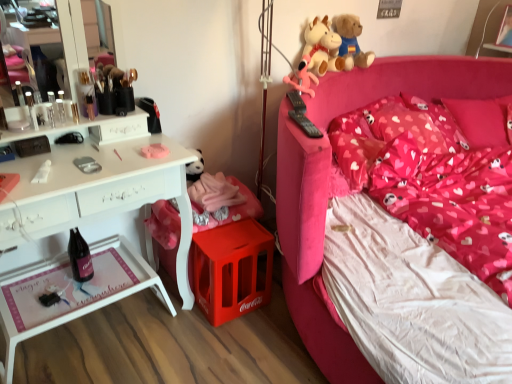
You are a GUI agent. You are given a task and a screenshot of the screen. Output one action in this format:
    pyautogui.click(x=<x>, y=<y>)
    Task: Click on the soft plush toys at upper right, placed as the 3th toy when sorted from front to back
    The width and height of the screenshot is (512, 384).
    Given the screenshot: What is the action you would take?
    pyautogui.click(x=351, y=42)

At what (x,y) coordinates should I click in order to perform the action: click on black glass bottle at lower left. Please return your answer as a coordinate pair (x, y). The image size is (512, 384). Looking at the image, I should click on (80, 257).

Find the location of `heart-patterned fabric pillow at upper right, which appears as the first pillow when viewed from the right`. heart-patterned fabric pillow at upper right, which appears as the first pillow when viewed from the right is located at coordinates (481, 120).

What are the coordinates of `white plastic tray at left` in the screenshot? It's located at (97, 192).

Describe the element at coordinates (310, 251) in the screenshot. I see `pink fabric bed at right` at that location.

What do you see at coordinates (439, 121) in the screenshot? The height and width of the screenshot is (384, 512). I see `heart-patterned fabric pillow at upper right, which is the second pillow from right to left` at bounding box center [439, 121].

The image size is (512, 384). Identify the location of soft plush cow at upper right, which ranks as the 2th toy in front-to-back order. (322, 47).

From a real-world perspective, is pink fabric bed at right above or below matte pink mattress at center?

pink fabric bed at right is below matte pink mattress at center.

From the image's perspective, between pink fabric bed at right and matte pink mattress at center, who is located below?

pink fabric bed at right, from the image's perspective.

Does pink fabric bed at right touch matte pink mattress at center?

They are not placed beside each other.

Would you say matte pink mattress at center is part of pink fabric bed at right's contents?

No, matte pink mattress at center is not inside pink fabric bed at right.

Locate an element on the screen. the 1st pillow directly above the white plastic tray at left (from a real-world perspective) is located at coordinates (481, 120).

Which of these two, heart-patterned fabric pillow at upper right, the third pillow when ordered from left to right, or white plastic tray at left, is bigger?

white plastic tray at left.

Is heart-patterned fabric pillow at upper right, which appears as the first pillow when viewed from the right, not within white plastic tray at left?

Indeed, heart-patterned fabric pillow at upper right, which appears as the first pillow when viewed from the right, is completely outside white plastic tray at left.

How distant is heart-patterned fabric pillow at upper right, the third pillow when ordered from left to right, from white plastic tray at left?

6.17 feet.

Is soft plush toys at upper right, placed as the 3th toy when sorted from front to back, far away from pink fabric pillow at upper right, the third pillow when ordered from right to left?

soft plush toys at upper right, placed as the 3th toy when sorted from front to back, is near pink fabric pillow at upper right, the third pillow when ordered from right to left, not far away.

Is pink fabric pillow at upper right, the third pillow when ordered from right to left, inside soft plush toys at upper right, placed as the 3th toy when sorted from front to back?

No, pink fabric pillow at upper right, the third pillow when ordered from right to left, is not a part of soft plush toys at upper right, placed as the 3th toy when sorted from front to back.

Is soft plush toys at upper right, placed as the 3th toy when sorted from front to back, turned away from pink fabric pillow at upper right, the third pillow when ordered from right to left?

No, soft plush toys at upper right, placed as the 3th toy when sorted from front to back,'s orientation is not away from pink fabric pillow at upper right, the third pillow when ordered from right to left.

From a real-world perspective, which object rests below the other?

pink fabric pillow at upper right, the third pillow when ordered from right to left, is physically lower.

Measure the distance between matte pink mattress at center and matte pink plush at upper right, which is counted as the 3th toy, starting from the back.

74.98 centimeters.

Is matte pink mattress at center at the left side of matte pink plush at upper right, which is counted as the 3th toy, starting from the back?

In fact, matte pink mattress at center is to the right of matte pink plush at upper right, which is counted as the 3th toy, starting from the back.

Considering the relative sizes of matte pink mattress at center and matte pink plush at upper right, which appears as the first toy when viewed from the front, in the image provided, is matte pink mattress at center bigger than matte pink plush at upper right, which appears as the first toy when viewed from the front,?

Yes.

From the image's perspective, does matte pink mattress at center appear higher than matte pink plush at upper right, which appears as the first toy when viewed from the front?

No, from the image's perspective, matte pink mattress at center is not above matte pink plush at upper right, which appears as the first toy when viewed from the front.

Is heart-patterned fabric pillow at upper right, acting as the 2th pillow starting from the left, at the right side of soft plush toys at upper right, placed as the 3th toy when sorted from front to back?

Correct, you'll find heart-patterned fabric pillow at upper right, acting as the 2th pillow starting from the left, to the right of soft plush toys at upper right, placed as the 3th toy when sorted from front to back.

Which point is more distant from viewer, (442,108) or (362,59)?

The point (442,108) is farther.

Considering the sizes of objects heart-patterned fabric pillow at upper right, acting as the 2th pillow starting from the left, and soft plush toys at upper right, placed as the 3th toy when sorted from front to back, in the image provided, who is shorter, heart-patterned fabric pillow at upper right, acting as the 2th pillow starting from the left, or soft plush toys at upper right, placed as the 3th toy when sorted from front to back,?

Standing shorter between the two is heart-patterned fabric pillow at upper right, acting as the 2th pillow starting from the left.

Which object is thinner, heart-patterned fabric pillow at upper right, acting as the 2th pillow starting from the left, or soft plush toys at upper right, the 1th toy when ordered from back to front?

soft plush toys at upper right, the 1th toy when ordered from back to front.

Is matte pink mattress at center bigger than heart-patterned fabric pillow at upper right, the third pillow when ordered from left to right?

Indeed, matte pink mattress at center has a larger size compared to heart-patterned fabric pillow at upper right, the third pillow when ordered from left to right.

Is the surface of matte pink mattress at center in direct contact with heart-patterned fabric pillow at upper right, which appears as the first pillow when viewed from the right?

No, matte pink mattress at center is not with heart-patterned fabric pillow at upper right, which appears as the first pillow when viewed from the right.

Where is `mattress in front of the heart-patterned fabric pillow at upper right, which appears as the first pillow when viewed from the right`? mattress in front of the heart-patterned fabric pillow at upper right, which appears as the first pillow when viewed from the right is located at coordinates (453, 204).

Does matte pink mattress at center have a lesser height compared to heart-patterned fabric pillow at upper right, the third pillow when ordered from left to right?

No.

Are soft plush toys at upper right, the 1th toy when ordered from back to front, and white plastic tray at left making contact?

soft plush toys at upper right, the 1th toy when ordered from back to front, is not next to white plastic tray at left, and they're not touching.

What's the angular difference between soft plush toys at upper right, placed as the 3th toy when sorted from front to back, and white plastic tray at left's facing directions?

There is a 1.88-degree angle between the facing directions of soft plush toys at upper right, placed as the 3th toy when sorted from front to back, and white plastic tray at left.

Is soft plush toys at upper right, the 1th toy when ordered from back to front, smaller than white plastic tray at left?

Correct, soft plush toys at upper right, the 1th toy when ordered from back to front, occupies less space than white plastic tray at left.

Could you tell me if soft plush toys at upper right, placed as the 3th toy when sorted from front to back, is facing white plastic tray at left?

No, soft plush toys at upper right, placed as the 3th toy when sorted from front to back, is not turned towards white plastic tray at left.

The width and height of the screenshot is (512, 384). In order to click on mattress that is behind the pink fabric bed at right in this screenshot , I will do `click(453, 204)`.

This screenshot has height=384, width=512. What are the coordinates of `desk lying in front of the heart-patterned fabric pillow at upper right, the third pillow when ordered from left to right` in the screenshot? It's located at (97, 192).

Looking at the image, which one is located further to soft plush toys at upper right, placed as the 3th toy when sorted from front to back, pink fabric bed at right or heart-patterned fabric pillow at upper right, which is the second pillow from right to left?

The object further to soft plush toys at upper right, placed as the 3th toy when sorted from front to back, is heart-patterned fabric pillow at upper right, which is the second pillow from right to left.

When comparing their distances from soft plush cow at upper right, which is the 2th toy from back to front, does matte pink plush at upper right, which is counted as the 3th toy, starting from the back, or heart-patterned fabric pillow at upper right, acting as the 2th pillow starting from the left, seem closer?

Based on the image, matte pink plush at upper right, which is counted as the 3th toy, starting from the back, appears to be nearer to soft plush cow at upper right, which is the 2th toy from back to front.

When comparing their distances from white plastic tray at left, does black glass bottle at lower left or matte pink mattress at center seem closer?

The object closer to white plastic tray at left is black glass bottle at lower left.

When comparing their distances from white plastic tray at left, does heart-patterned fabric pillow at upper right, the third pillow when ordered from left to right, or pink fabric bed at right seem closer?

Based on the image, pink fabric bed at right appears to be nearer to white plastic tray at left.

Based on their spatial positions, is pink fabric bed at right or pink fabric pillow at upper right, the 1th pillow when ordered from left to right, further from matte pink plush at upper right, which appears as the first toy when viewed from the front?

pink fabric pillow at upper right, the 1th pillow when ordered from left to right.

Based on their spatial positions, is heart-patterned fabric pillow at upper right, which appears as the first pillow when viewed from the right, or matte pink mattress at center further from black glass bottle at lower left?

heart-patterned fabric pillow at upper right, which appears as the first pillow when viewed from the right, is positioned further to the anchor black glass bottle at lower left.

Looking at the image, which one is located further to heart-patterned fabric pillow at upper right, which appears as the first pillow when viewed from the right, pink fabric bed at right or matte pink mattress at center?

matte pink mattress at center is further to heart-patterned fabric pillow at upper right, which appears as the first pillow when viewed from the right.

When comparing their distances from pink fabric bed at right, does pink fabric pillow at upper right, the third pillow when ordered from right to left, or soft plush cow at upper right, which is the 2th toy from back to front, seem further?

The object further to pink fabric bed at right is pink fabric pillow at upper right, the third pillow when ordered from right to left.

At what (x,y) coordinates should I click in order to perform the action: click on mattress between black glass bottle at lower left and heart-patterned fabric pillow at upper right, which appears as the first pillow when viewed from the right, in the horizontal direction. Please return your answer as a coordinate pair (x, y). Image resolution: width=512 pixels, height=384 pixels. Looking at the image, I should click on (453, 204).

I want to click on mattress positioned between pink fabric bed at right and heart-patterned fabric pillow at upper right, which is the second pillow from right to left, from near to far, so click(x=453, y=204).

Locate an element on the screen. The height and width of the screenshot is (384, 512). toy located between soft plush cow at upper right, which ranks as the 2th toy in front-to-back order, and pink fabric pillow at upper right, the 1th pillow when ordered from left to right, in the left-right direction is located at coordinates (351, 42).

Image resolution: width=512 pixels, height=384 pixels. What are the coordinates of `pillow between matte pink mattress at center and soft plush toys at upper right, placed as the 3th toy when sorted from front to back, along the z-axis` in the screenshot? It's located at (406, 127).